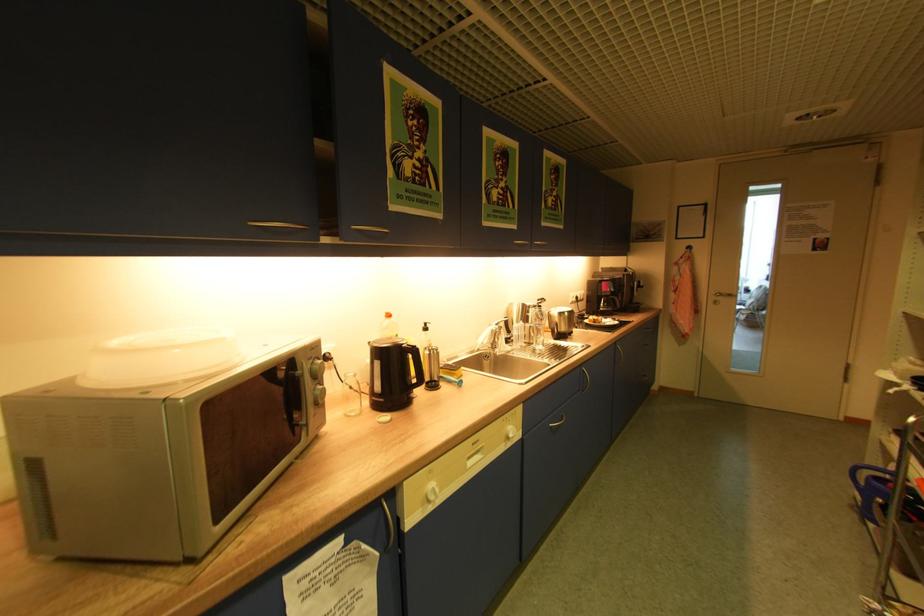
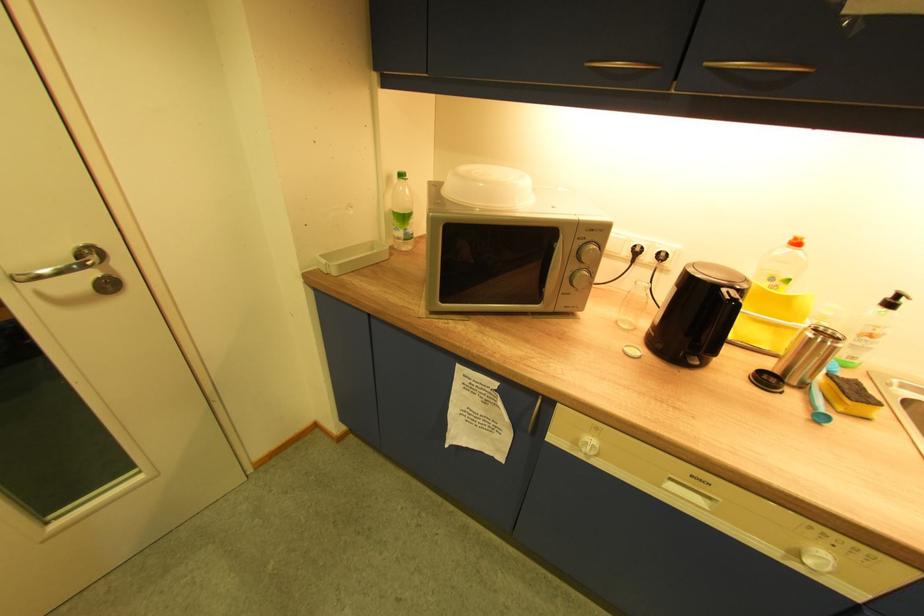
Based on the continuous images, in which direction is the camera rotating?

The rotation direction of the camera is left-down.